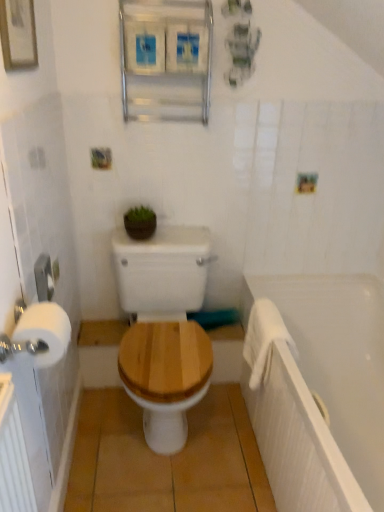
Question: Is wooden toilet seat at center to the left of white plastic towel bar at left from the viewer's perspective?

Choices:
 (A) yes
 (B) no

Answer: (B)

Question: Considering the relative sizes of wooden toilet seat at center and white plastic towel bar at left in the image provided, is wooden toilet seat at center thinner than white plastic towel bar at left?

Choices:
 (A) yes
 (B) no

Answer: (B)

Question: Is wooden toilet seat at center not close to white plastic towel bar at left?

Choices:
 (A) yes
 (B) no

Answer: (B)

Question: Is wooden toilet seat at center smaller than white plastic towel bar at left?

Choices:
 (A) no
 (B) yes

Answer: (A)

Question: Is wooden toilet seat at center taller than white plastic towel bar at left?

Choices:
 (A) no
 (B) yes

Answer: (B)

Question: Considering the relative sizes of wooden toilet seat at center and white plastic towel bar at left in the image provided, is wooden toilet seat at center wider than white plastic towel bar at left?

Choices:
 (A) no
 (B) yes

Answer: (B)

Question: Is wooden toilet seat at center looking in the opposite direction of white soft towel at right?

Choices:
 (A) no
 (B) yes

Answer: (A)

Question: Considering the relative sizes of wooden toilet seat at center and white soft towel at right in the image provided, is wooden toilet seat at center shorter than white soft towel at right?

Choices:
 (A) yes
 (B) no

Answer: (B)

Question: Considering the relative sizes of wooden toilet seat at center and white soft towel at right in the image provided, is wooden toilet seat at center bigger than white soft towel at right?

Choices:
 (A) no
 (B) yes

Answer: (B)

Question: Is wooden toilet seat at center positioned far away from white soft towel at right?

Choices:
 (A) no
 (B) yes

Answer: (A)

Question: Is wooden toilet seat at center to the right of white soft towel at right from the viewer's perspective?

Choices:
 (A) yes
 (B) no

Answer: (B)

Question: Is wooden toilet seat at center further to the viewer compared to white soft towel at right?

Choices:
 (A) no
 (B) yes

Answer: (A)

Question: From a real-world perspective, is white soft towel at right below white matte bathtub at right?

Choices:
 (A) no
 (B) yes

Answer: (A)